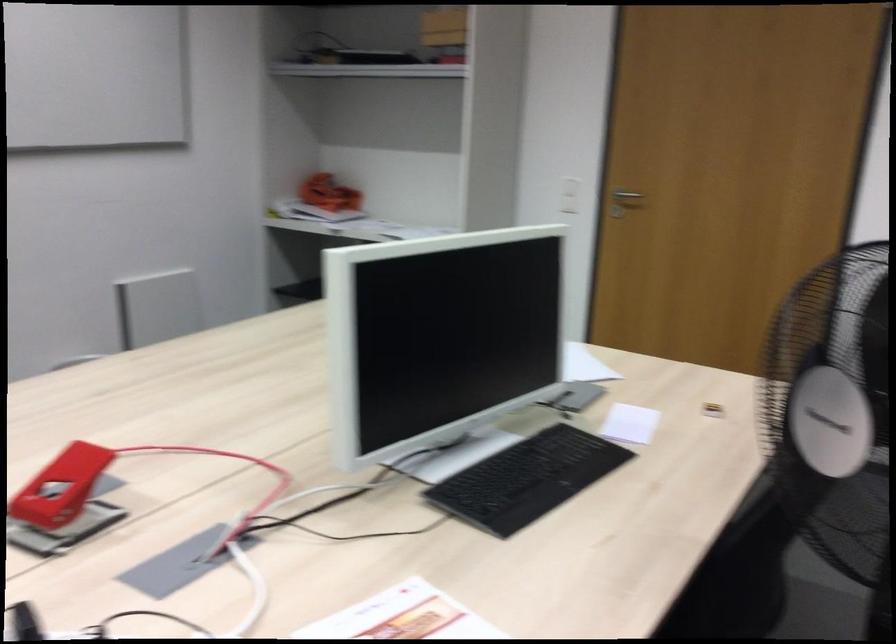
Where is `silver door handle`? silver door handle is located at coordinates (624, 202).